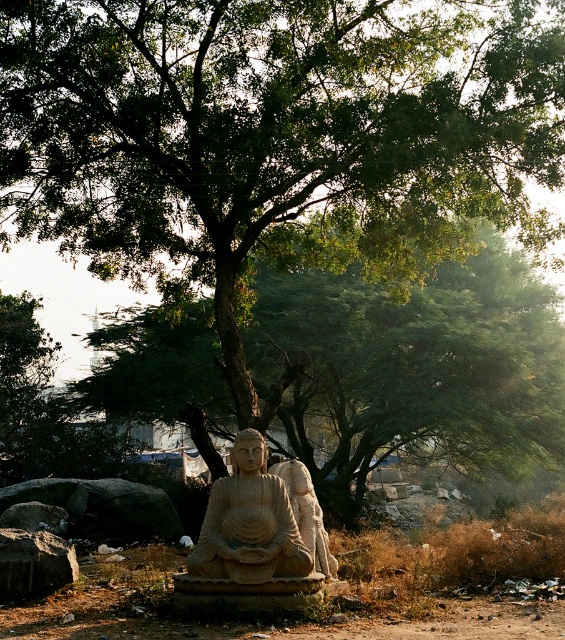
Question: Among these points, which one is nearest to the camera?

Choices:
 (A) (319, 541)
 (B) (23, 545)
 (C) (72, 602)
 (D) (297, 550)

Answer: (D)

Question: Does sandy beige statue at center have a lesser width compared to carved stone statue at center?

Choices:
 (A) yes
 (B) no

Answer: (B)

Question: Is sandy beige statue at center to the left of carved stone statue at center from the viewer's perspective?

Choices:
 (A) no
 (B) yes

Answer: (B)

Question: Which object is farther from the camera taking this photo?

Choices:
 (A) rough gray rock at lower left
 (B) brown dirt field at center
 (C) carved stone statue at center

Answer: (C)

Question: Which point is closer to the camera?

Choices:
 (A) (268, 572)
 (B) (541, 627)
 (C) (29, 536)

Answer: (B)

Question: Does brown dirt field at center have a greater width compared to carved stone statue at center?

Choices:
 (A) yes
 (B) no

Answer: (A)